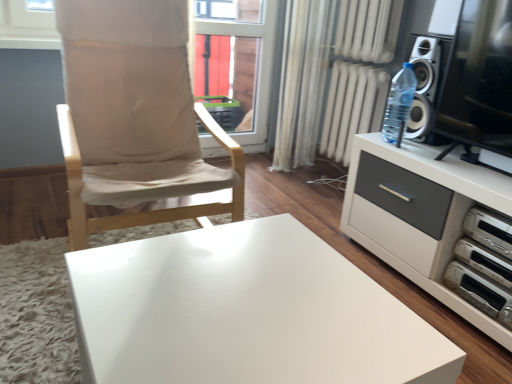
Where is `vacant area situated below white sheer curtain at center (from a real-world perspective)`? vacant area situated below white sheer curtain at center (from a real-world perspective) is located at coordinates (295, 162).